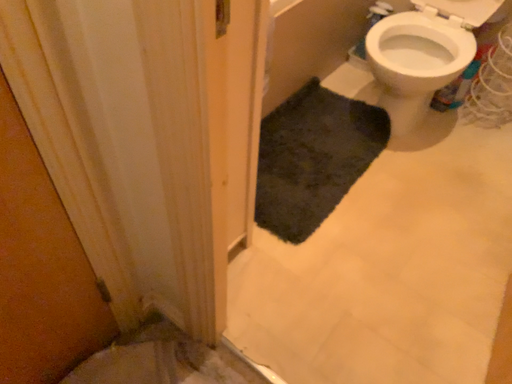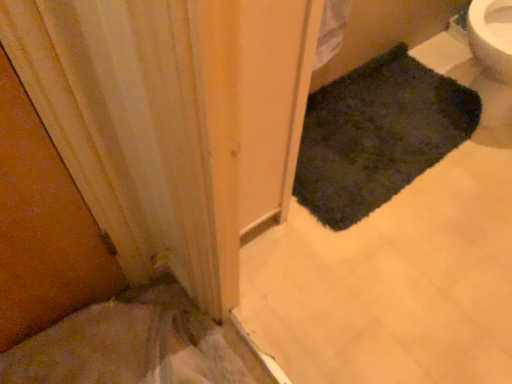
Question: Which way did the camera rotate in the video?

Choices:
 (A) rotated right
 (B) rotated left

Answer: (B)